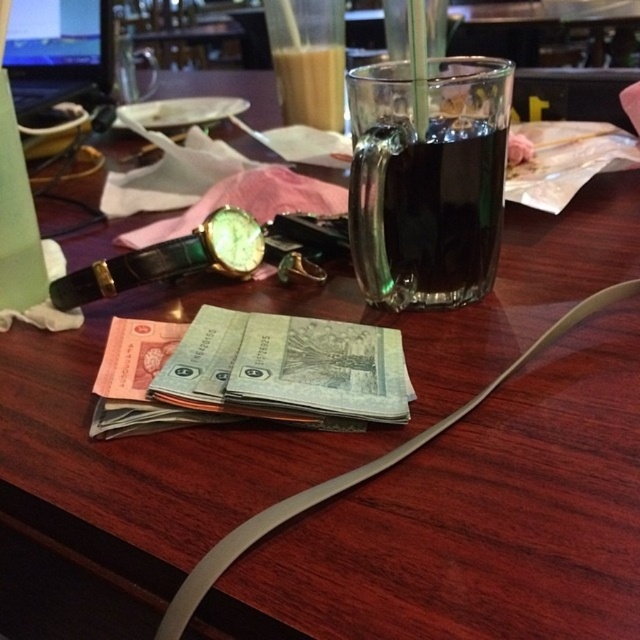
Question: Which point appears farthest from the camera in this image?

Choices:
 (A) (284, 74)
 (B) (291, 515)
 (C) (412, 234)

Answer: (A)

Question: Estimate the real-world distances between objects in this image. Which object is farther from the dark glass mug at upper center?

Choices:
 (A) translucent glass cup at upper center
 (B) gray rubber strap at center

Answer: (A)

Question: Among these objects, which one is nearest to the camera?

Choices:
 (A) translucent glass cup at upper center
 (B) dark glass mug at upper center

Answer: (B)

Question: Does dark glass mug at upper center lie in front of translucent glass cup at upper center?

Choices:
 (A) yes
 (B) no

Answer: (A)

Question: Is gray rubber strap at center bigger than translucent glass cup at upper center?

Choices:
 (A) yes
 (B) no

Answer: (A)

Question: Is gray rubber strap at center positioned at the back of translucent glass cup at upper center?

Choices:
 (A) yes
 (B) no

Answer: (B)